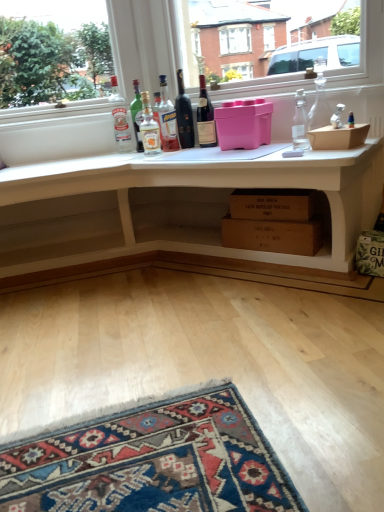
Find the location of a particular element. The width and height of the screenshot is (384, 512). green paper bag at lower right is located at coordinates (370, 253).

I want to click on brown cardboard box at center, marked as the 2th box in a top-to-bottom arrangement, so click(x=273, y=234).

This screenshot has width=384, height=512. What do you see at coordinates (273, 234) in the screenshot? I see `brown cardboard box at center, which is the first box from bottom to top` at bounding box center [273, 234].

The width and height of the screenshot is (384, 512). What do you see at coordinates (300, 123) in the screenshot?
I see `clear glass bottle at upper right, arranged as the 2th bottle when viewed from the right` at bounding box center [300, 123].

Where is `clear glass bottle at center, placed as the 1th bottle when sorted from left to right`? This screenshot has height=512, width=384. clear glass bottle at center, placed as the 1th bottle when sorted from left to right is located at coordinates (120, 119).

Who is smaller, clear glass bottle at upper right, which ranks as the 6th bottle in left-to-right order, or brown cardboard box at center, marked as the 2th box in a top-to-bottom arrangement?

Smaller between the two is clear glass bottle at upper right, which ranks as the 6th bottle in left-to-right order.

Considering the relative sizes of clear glass bottle at upper right, arranged as the 2th bottle when viewed from the right, and brown cardboard box at center, marked as the 2th box in a top-to-bottom arrangement, in the image provided, is clear glass bottle at upper right, arranged as the 2th bottle when viewed from the right, shorter than brown cardboard box at center, marked as the 2th box in a top-to-bottom arrangement,?

In fact, clear glass bottle at upper right, arranged as the 2th bottle when viewed from the right, may be taller than brown cardboard box at center, marked as the 2th box in a top-to-bottom arrangement.

Would you say clear glass bottle at upper right, arranged as the 2th bottle when viewed from the right, is a long distance from brown cardboard box at center, marked as the 2th box in a top-to-bottom arrangement?

That's not correct — clear glass bottle at upper right, arranged as the 2th bottle when viewed from the right, is a little close to brown cardboard box at center, marked as the 2th box in a top-to-bottom arrangement.

From the image's perspective, is clear glass decanter at upper right, the first bottle viewed from the right, positioned above or below translucent glass bottle at center, positioned as the fifth bottle in right-to-left order?

From the image's perspective, clear glass decanter at upper right, the first bottle viewed from the right, appears below translucent glass bottle at center, positioned as the fifth bottle in right-to-left order.

From the picture: Which of these two, clear glass decanter at upper right, the first bottle viewed from the right, or translucent glass bottle at center, which is counted as the 3th bottle, starting from the left, stands shorter?

clear glass decanter at upper right, the first bottle viewed from the right.

The width and height of the screenshot is (384, 512). I want to click on the 4th bottle to the left of the clear glass decanter at upper right, which is counted as the seventh bottle, starting from the left, counting from the anchor's position, so click(167, 120).

Are pink plastic container at center, marked as the second box in a bottom-to-top arrangement, and clear glass decanter at upper right, which is counted as the seventh bottle, starting from the left, located far from each other?

That's not correct — pink plastic container at center, marked as the second box in a bottom-to-top arrangement, is a little close to clear glass decanter at upper right, which is counted as the seventh bottle, starting from the left.

Which of these two, pink plastic container at center, which ranks as the 1th box in top-to-bottom order, or clear glass decanter at upper right, the first bottle viewed from the right, is wider?

Wider between the two is pink plastic container at center, which ranks as the 1th box in top-to-bottom order.

How many degrees apart are the facing directions of pink plastic container at center, marked as the second box in a bottom-to-top arrangement, and clear glass decanter at upper right, which is counted as the seventh bottle, starting from the left?

There is a 2.65-degree angle between the facing directions of pink plastic container at center, marked as the second box in a bottom-to-top arrangement, and clear glass decanter at upper right, which is counted as the seventh bottle, starting from the left.

Could you tell me if pink plastic container at center, marked as the second box in a bottom-to-top arrangement, is facing clear glass decanter at upper right, which is counted as the seventh bottle, starting from the left?

No, pink plastic container at center, marked as the second box in a bottom-to-top arrangement, does not turn towards clear glass decanter at upper right, which is counted as the seventh bottle, starting from the left.

You are a GUI agent. You are given a task and a screenshot of the screen. Output one action in this format:
    pyautogui.click(x=<x>, y=<y>)
    Task: Click on the 1st bottle in front of the translucent glass bottle at center, which is counted as the 3th bottle, starting from the left, counting from the anchor's position
    This screenshot has height=512, width=384.
    Given the screenshot: What is the action you would take?
    pyautogui.click(x=205, y=117)

How many degrees apart are the facing directions of dark red glass wine bottle at center, placed as the 5th bottle when sorted from left to right, and translucent glass bottle at center, which is counted as the 3th bottle, starting from the left?

There is a 13.1-degree angle between the facing directions of dark red glass wine bottle at center, placed as the 5th bottle when sorted from left to right, and translucent glass bottle at center, which is counted as the 3th bottle, starting from the left.

Which is behind, point (211, 106) or point (167, 117)?

The point (167, 117) is farther from the camera.

From a real-world perspective, is dark red glass wine bottle at center, the third bottle when ordered from right to left, physically below translucent glass bottle at center, positioned as the fifth bottle in right-to-left order?

Yes.

The width and height of the screenshot is (384, 512). Find the location of `the 3rd bottle directly above the clear glass decanter at upper right, which is counted as the seventh bottle, starting from the left (from a real-world perspective)`. the 3rd bottle directly above the clear glass decanter at upper right, which is counted as the seventh bottle, starting from the left (from a real-world perspective) is located at coordinates (184, 115).

Who is shorter, dark glass wine bottle at center, placed as the fourth bottle when sorted from left to right, or clear glass decanter at upper right, which is counted as the seventh bottle, starting from the left?

Standing shorter between the two is clear glass decanter at upper right, which is counted as the seventh bottle, starting from the left.

From the image's perspective, is dark glass wine bottle at center, marked as the 4th bottle in a right-to-left arrangement, located beneath clear glass decanter at upper right, the first bottle viewed from the right?

No.

From a real-world perspective, who is located higher, dark glass wine bottle at center, placed as the fourth bottle when sorted from left to right, or clear glass decanter at upper right, which is counted as the seventh bottle, starting from the left?

In real-world perspective, dark glass wine bottle at center, placed as the fourth bottle when sorted from left to right, is above.

Is clear glass bottle at center, placed as the 1th bottle when sorted from left to right, oriented towards translucent glass bottle at center, which ranks as the 6th bottle in right-to-left order?

No, clear glass bottle at center, placed as the 1th bottle when sorted from left to right, is not facing towards translucent glass bottle at center, which ranks as the 6th bottle in right-to-left order.

From a real-world perspective, is clear glass bottle at center, placed as the 1th bottle when sorted from left to right, physically above translucent glass bottle at center, which ranks as the second bottle in left-to-right order?

Yes, from a real-world perspective, clear glass bottle at center, placed as the 1th bottle when sorted from left to right, is over translucent glass bottle at center, which ranks as the second bottle in left-to-right order

Is translucent glass bottle at center, which ranks as the 6th bottle in right-to-left order, inside clear glass bottle at center, placed as the 1th bottle when sorted from left to right?

No.

Does point (121, 148) lie in front of point (148, 147)?

No, (121, 148) is behind (148, 147).

From the picture: Could you tell me if green paper bag at lower right is facing clear glass bottle at center, placed as the 1th bottle when sorted from left to right?

No, green paper bag at lower right is not facing towards clear glass bottle at center, placed as the 1th bottle when sorted from left to right.

From a real-world perspective, is green paper bag at lower right under clear glass bottle at center, which ranks as the seventh bottle in right-to-left order?

Correct, in the physical world, green paper bag at lower right is lower than clear glass bottle at center, which ranks as the seventh bottle in right-to-left order.

In terms of size, does green paper bag at lower right appear bigger or smaller than clear glass bottle at center, placed as the 1th bottle when sorted from left to right?

Clearly, green paper bag at lower right is larger in size than clear glass bottle at center, placed as the 1th bottle when sorted from left to right.

From the image's perspective, is green paper bag at lower right located beneath clear glass bottle at center, placed as the 1th bottle when sorted from left to right?

Yes.

From the clear glass bottle at upper right, which ranks as the 6th bottle in left-to-right order, count the 1st box to the left and point to it. Please provide its 2D coordinates.

[(273, 234)]

At what (x,y) coordinates should I click in order to perform the action: click on bottle that is the 1st one when counting downward from the translucent glass bottle at center, which is counted as the 3th bottle, starting from the left (from the image's perspective). Please return your answer as a coordinate pair (x, y). This screenshot has width=384, height=512. Looking at the image, I should click on point(319,99).

Which object lies nearer to the anchor point brown cardboard box at center, marked as the 2th box in a top-to-bottom arrangement, translucent glass bottle at center, which is counted as the 3th bottle, starting from the left, or dark red glass wine bottle at center, the third bottle when ordered from right to left?

dark red glass wine bottle at center, the third bottle when ordered from right to left, lies closer to brown cardboard box at center, marked as the 2th box in a top-to-bottom arrangement, than the other object.

When comparing their distances from clear glass decanter at upper right, which is counted as the seventh bottle, starting from the left, does pink plastic container at center, marked as the second box in a bottom-to-top arrangement, or dark glass wine bottle at center, placed as the fourth bottle when sorted from left to right, seem closer?

Based on the image, pink plastic container at center, marked as the second box in a bottom-to-top arrangement, appears to be nearer to clear glass decanter at upper right, which is counted as the seventh bottle, starting from the left.

Consider the image. Looking at the image, which one is located further to translucent glass bottle at center, which ranks as the 6th bottle in right-to-left order, brown cardboard box at center, marked as the 2th box in a top-to-bottom arrangement, or green paper bag at lower right?

Among the two, green paper bag at lower right is located further to translucent glass bottle at center, which ranks as the 6th bottle in right-to-left order.

Looking at the image, which one is located closer to dark red glass wine bottle at center, the third bottle when ordered from right to left, pink plastic container at center, marked as the second box in a bottom-to-top arrangement, or brown cardboard box at center, which is the first box from bottom to top?

Based on the image, pink plastic container at center, marked as the second box in a bottom-to-top arrangement, appears to be nearer to dark red glass wine bottle at center, the third bottle when ordered from right to left.

Which object lies nearer to the anchor point clear glass decanter at upper right, which is counted as the seventh bottle, starting from the left, dark red glass wine bottle at center, placed as the 5th bottle when sorted from left to right, or white matte desk at center?

Among the two, dark red glass wine bottle at center, placed as the 5th bottle when sorted from left to right, is located nearer to clear glass decanter at upper right, which is counted as the seventh bottle, starting from the left.

Based on the photo, based on their spatial positions, is pink plastic container at center, marked as the second box in a bottom-to-top arrangement, or clear glass decanter at upper right, which is counted as the seventh bottle, starting from the left, closer to dark red glass wine bottle at center, the third bottle when ordered from right to left?

The object closer to dark red glass wine bottle at center, the third bottle when ordered from right to left, is pink plastic container at center, marked as the second box in a bottom-to-top arrangement.

Estimate the real-world distances between objects in this image. Which object is closer to green paper bag at lower right, brown cardboard box at center, which is the first box from bottom to top, or clear glass bottle at center, which ranks as the seventh bottle in right-to-left order?

brown cardboard box at center, which is the first box from bottom to top.

Looking at the image, which one is located further to dark red glass wine bottle at center, the third bottle when ordered from right to left, clear glass bottle at center, which ranks as the seventh bottle in right-to-left order, or pink plastic container at center, marked as the second box in a bottom-to-top arrangement?

clear glass bottle at center, which ranks as the seventh bottle in right-to-left order, is further to dark red glass wine bottle at center, the third bottle when ordered from right to left.

The width and height of the screenshot is (384, 512). What are the coordinates of `box between dark red glass wine bottle at center, placed as the 5th bottle when sorted from left to right, and brown cardboard box at center, which is the first box from bottom to top, in the up-down direction` in the screenshot? It's located at (243, 124).

I want to click on box located between translucent glass bottle at center, which ranks as the second bottle in left-to-right order, and brown cardboard box at center, marked as the 2th box in a top-to-bottom arrangement, in the left-right direction, so click(x=243, y=124).

Find the location of a particular element. The height and width of the screenshot is (512, 384). box between dark glass wine bottle at center, marked as the 4th bottle in a right-to-left arrangement, and brown cardboard box at center, which is the first box from bottom to top, in the vertical direction is located at coordinates (243, 124).

Find the location of a particular element. The width and height of the screenshot is (384, 512). bottle that lies between pink plastic container at center, marked as the second box in a bottom-to-top arrangement, and brown cardboard box at center, which is the first box from bottom to top, from top to bottom is located at coordinates (300, 123).